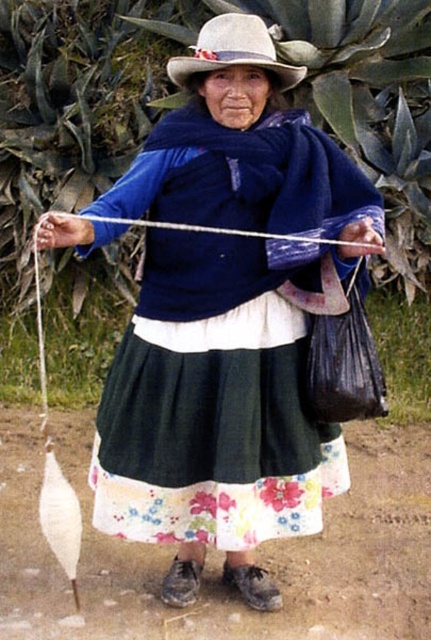
Consider the image. You are standing in front of the person crafting and want to place a small gift at point A and point B. If point A is at coordinate point (206, 36) and point B is at coordinate point (368, 224), which point is closer to you?

Point A at coordinate point (206, 36) is closer to you because it is further to the viewer than point B at coordinate point (368, 224).

You are a photographer standing 10 feet away from the person in the image. You want to take a closeup shot of the matte blue sweater at center without moving your position. Is the sweater within your camera lens range if the camera can focus as close as 6 feet?

The matte blue sweater at center is 6.44 feet away from the camera. Since the camera can focus as close as 6 feet, the sweater is within the focus range because 6.44 feet is greater than 6 feet. Therefore, the photographer can take the closeup shot without moving.